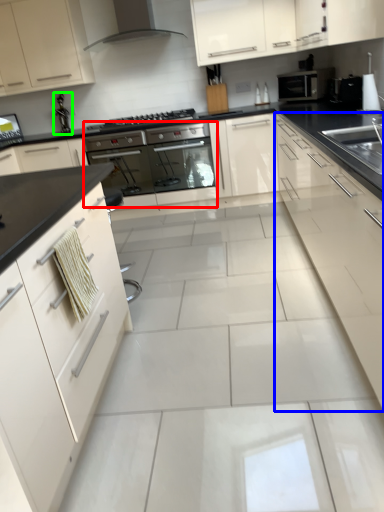
Question: Considering the real-world distances, which object is closest to oven (highlighted by a red box)? cabinetry (highlighted by a blue box) or faucet (highlighted by a green box).

Choices:
 (A) cabinetry
 (B) faucet

Answer: (B)